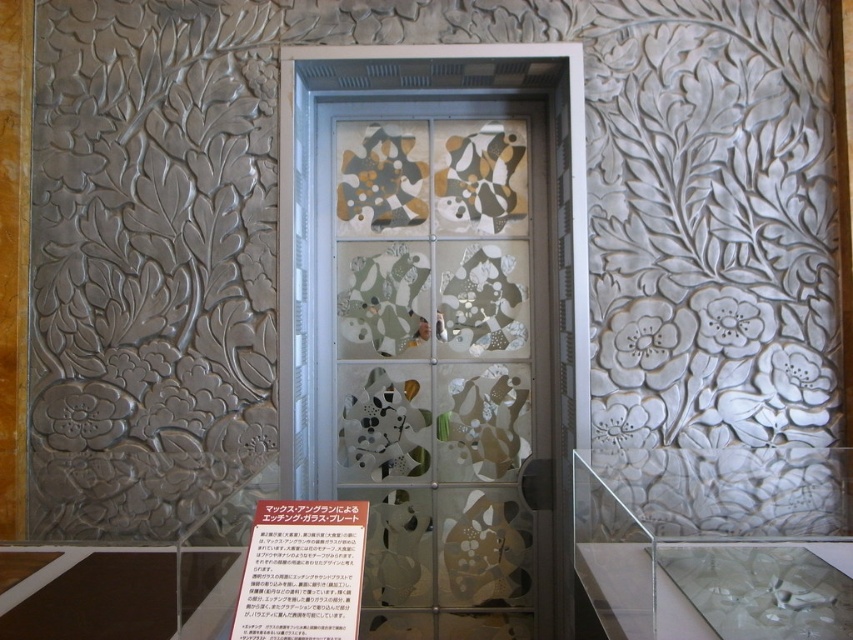
Who is positioned more to the left, etched glass door at center or white paper at center?

white paper at center is more to the left.

Can you confirm if etched glass door at center is positioned above white paper at center?

Yes.

Who is more forward, [465,476] or [279,572]?

Positioned in front is point [279,572].

Locate an element on the screen. The height and width of the screenshot is (640, 853). etched glass door at center is located at coordinates (444, 364).